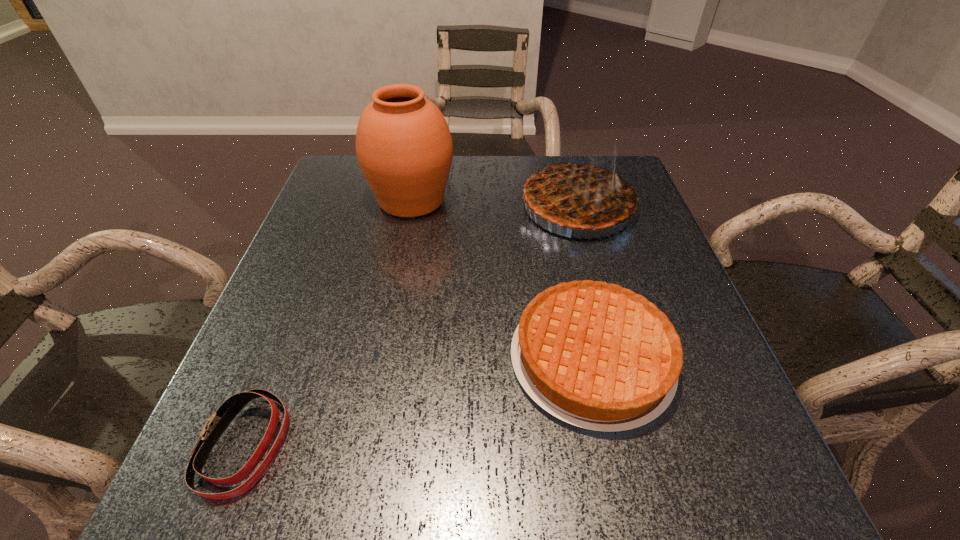
This screenshot has height=540, width=960. In order to click on empty space that is in between the dog collar and the urn in this screenshot , I will do `click(328, 322)`.

This screenshot has width=960, height=540. I want to click on free space that is in between the leftmost object and the farther pie, so click(x=411, y=326).

In order to click on blank region between the leftmost object and the second object from left to right in this screenshot , I will do `click(328, 322)`.

The image size is (960, 540). Find the location of `free area in between the leftmost object and the shorter pie`. free area in between the leftmost object and the shorter pie is located at coordinates (419, 402).

This screenshot has width=960, height=540. In order to click on vacant space that's between the taller pie and the tallest object in this screenshot , I will do `click(494, 204)`.

Identify which object is the third nearest to the taller pie. Please provide its 2D coordinates. Your answer should be formatted as a tuple, i.e. [(x, y)], where the tuple contains the x and y coordinates of a point satisfying the conditions above.

[(218, 422)]

Locate an element on the screen. Image resolution: width=960 pixels, height=540 pixels. object that is the nearest to the tallest object is located at coordinates (577, 194).

Where is `free region that satisfies the following two spatial constraints: 1. on the front side of the tallest object; 2. on the right side of the second tallest object`? free region that satisfies the following two spatial constraints: 1. on the front side of the tallest object; 2. on the right side of the second tallest object is located at coordinates (410, 207).